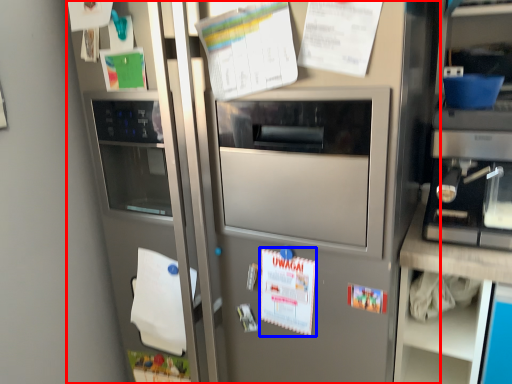
Question: Among these objects, which one is nearest to the camera, fridge (highlighted by a red box) or poster (highlighted by a blue box)?

Choices:
 (A) fridge
 (B) poster

Answer: (A)